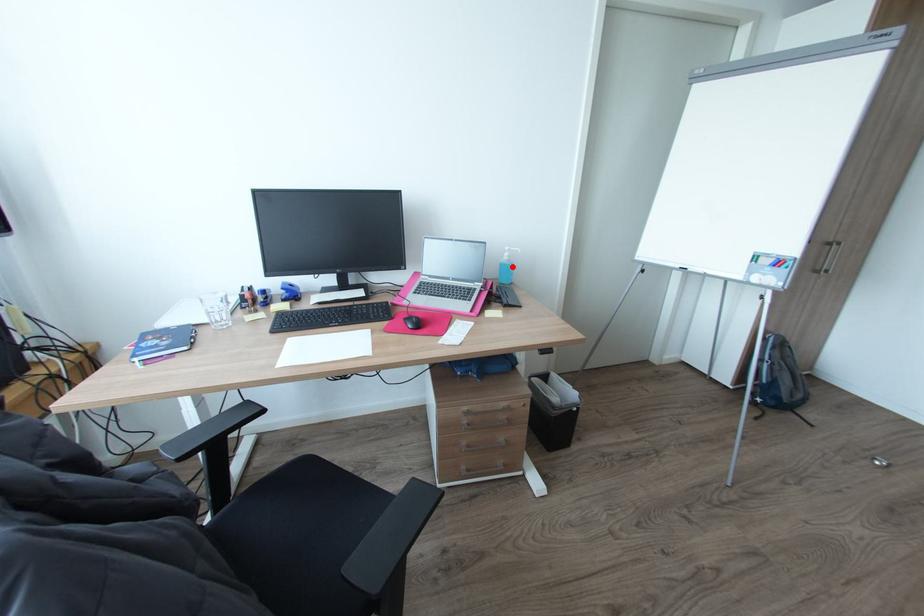
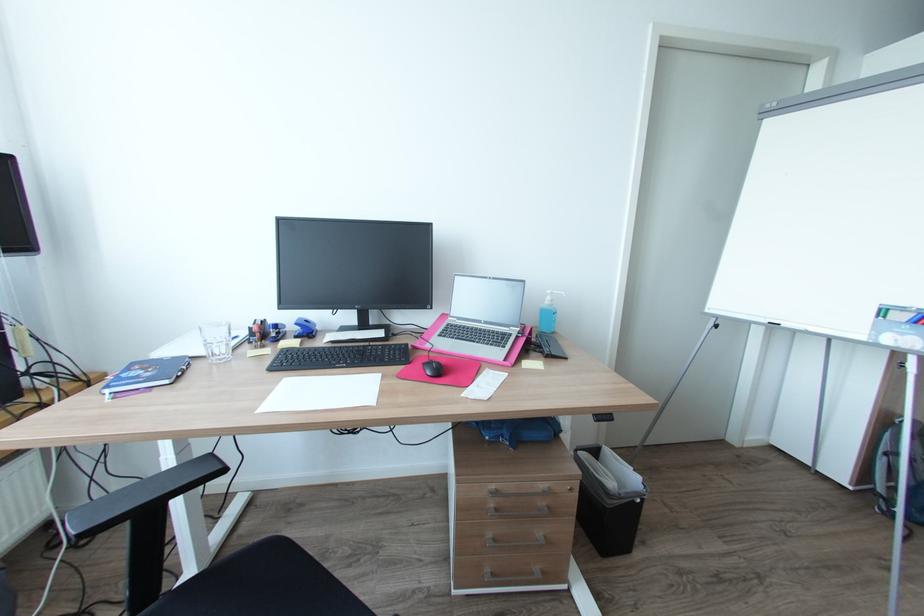
Where in the second image is the point corresponding to the highlighted location from the first image?

(554, 313)